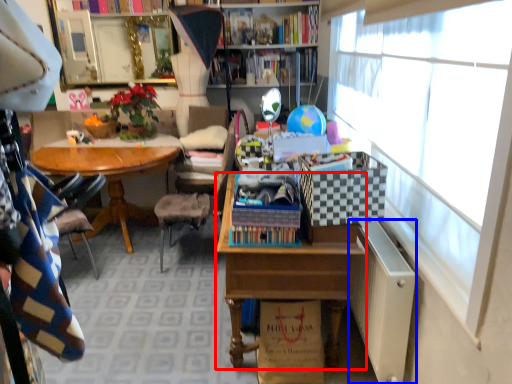
Question: Which object appears farthest to the camera in this image, desk (highlighted by a red box) or file cabinet (highlighted by a blue box)?

Choices:
 (A) desk
 (B) file cabinet

Answer: (A)